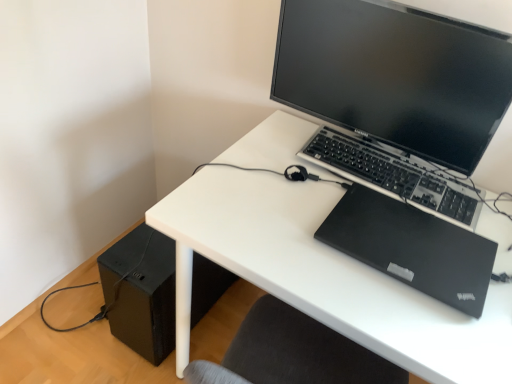
Question: Can you confirm if black matte laptop at upper right is smaller than black matte speaker at lower left?

Choices:
 (A) yes
 (B) no

Answer: (A)

Question: Does black matte laptop at upper right lie behind black matte speaker at lower left?

Choices:
 (A) no
 (B) yes

Answer: (A)

Question: Considering the relative sizes of black matte laptop at upper right and black matte speaker at lower left in the image provided, is black matte laptop at upper right bigger than black matte speaker at lower left?

Choices:
 (A) no
 (B) yes

Answer: (A)

Question: Is black matte laptop at upper right next to black matte speaker at lower left and touching it?

Choices:
 (A) no
 (B) yes

Answer: (A)

Question: Is black matte laptop at upper right turned away from black matte speaker at lower left?

Choices:
 (A) yes
 (B) no

Answer: (B)

Question: Are black matte laptop at upper right and black matte speaker at lower left far apart?

Choices:
 (A) yes
 (B) no

Answer: (B)

Question: Is black plastic keyboard at center located within black matte speaker at lower left?

Choices:
 (A) yes
 (B) no

Answer: (B)

Question: Is black matte speaker at lower left completely or partially outside of black plastic keyboard at center?

Choices:
 (A) yes
 (B) no

Answer: (A)

Question: Can you confirm if black matte speaker at lower left is shorter than black plastic keyboard at center?

Choices:
 (A) no
 (B) yes

Answer: (A)

Question: Can you confirm if black matte speaker at lower left is bigger than black plastic keyboard at center?

Choices:
 (A) no
 (B) yes

Answer: (B)

Question: From a real-world perspective, is black matte speaker at lower left physically above black plastic keyboard at center?

Choices:
 (A) yes
 (B) no

Answer: (B)

Question: Is black matte speaker at lower left aimed at black plastic keyboard at center?

Choices:
 (A) no
 (B) yes

Answer: (A)

Question: Is matte black monitor at upper center at the back of black plastic keyboard at center?

Choices:
 (A) yes
 (B) no

Answer: (A)